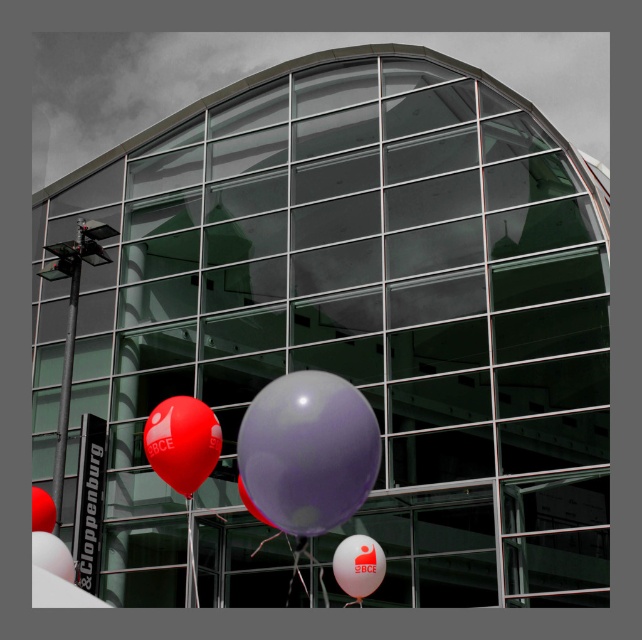
You are planning to take a photo of the purple matte balloon at center and the matte white balloon at lower left. Which balloon should you zoom in more on to ensure both are in focus?

The purple matte balloon at center is larger than the matte white balloon at lower left, so you should zoom in more on the purple matte balloon at center to ensure both are in focus.

You are standing in front of the modern glass building and notice the matte white balloon at lower left. If you were to draw a straight line from your eye level to the balloon, what coordinates would this line intersect on the building?

The line from your eye level to the matte white balloon at lower left would intersect the building at coordinates approximately 0.869 in the x and 0.083 in the y direction.

You are a photographer trying to capture a closeup shot of the purple glossy balloon at center and the purple matte balloon at center. Your camera can focus on objects within a 3 meter range. Can you take a photo of both balloons without moving your camera?

The purple glossy balloon at center is 3.36 meters away from the purple matte balloon at center. Since the distance between them exceeds the camera focus range of 3 meters, you cannot capture both balloons in focus simultaneously without moving the camera.